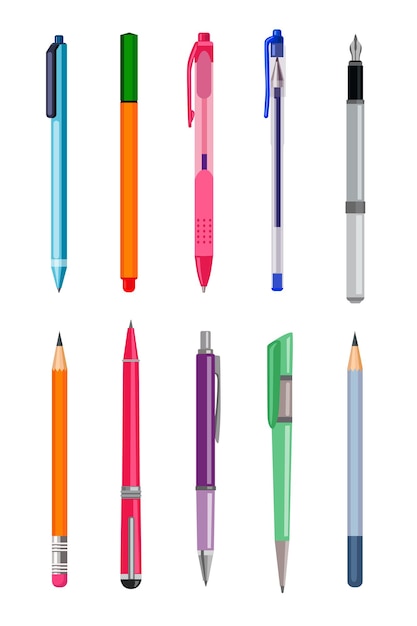
Where is `pens in top row`? The image size is (417, 626). pens in top row is located at coordinates (58, 106), (129, 88), (200, 95), (276, 98), (354, 116).